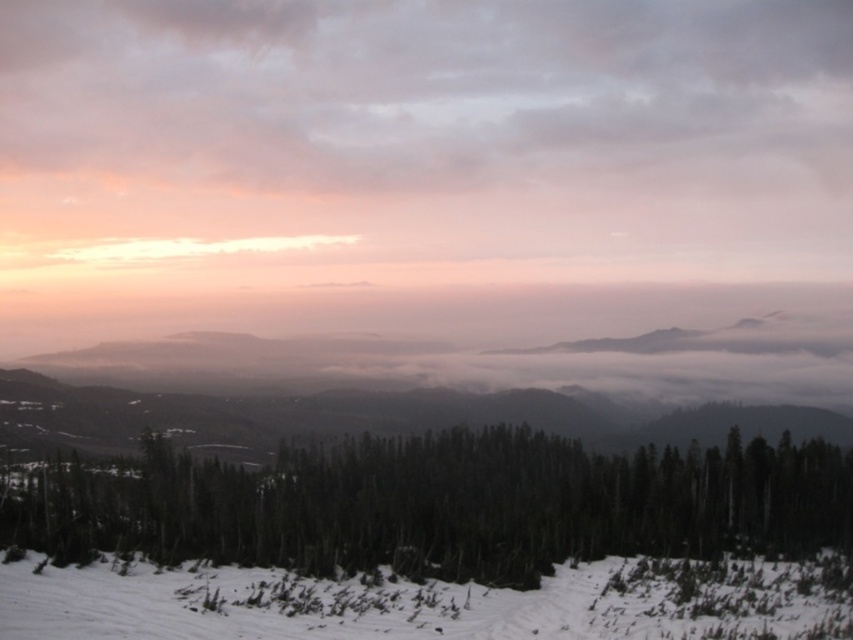
Is green matte trees at center to the left of white snow at lower center from the viewer's perspective?

Indeed, green matte trees at center is positioned on the left side of white snow at lower center.

Can you confirm if green matte trees at center is positioned above white snow at lower center?

Incorrect, green matte trees at center is not positioned above white snow at lower center.

Identify the location of green matte trees at center. This screenshot has height=640, width=853. (438, 504).

Is point (207, 177) farther from camera compared to point (383, 499)?

Yes, it is.

Locate an element on the screen. Image resolution: width=853 pixels, height=640 pixels. pink/cloudy sky at upper center is located at coordinates (428, 93).

Which is above, pink/cloudy sky at upper center or white snow at lower center?

pink/cloudy sky at upper center is above.

Is point (434, 12) positioned after point (317, 620)?

Yes, point (434, 12) is behind point (317, 620).

At what (x,y) coordinates should I click in order to perform the action: click on pink/cloudy sky at upper center. Please return your answer as a coordinate pair (x, y). The image size is (853, 640). Looking at the image, I should click on (428, 93).

This screenshot has width=853, height=640. What are the coordinates of `pink/cloudy sky at upper center` in the screenshot? It's located at (428, 93).